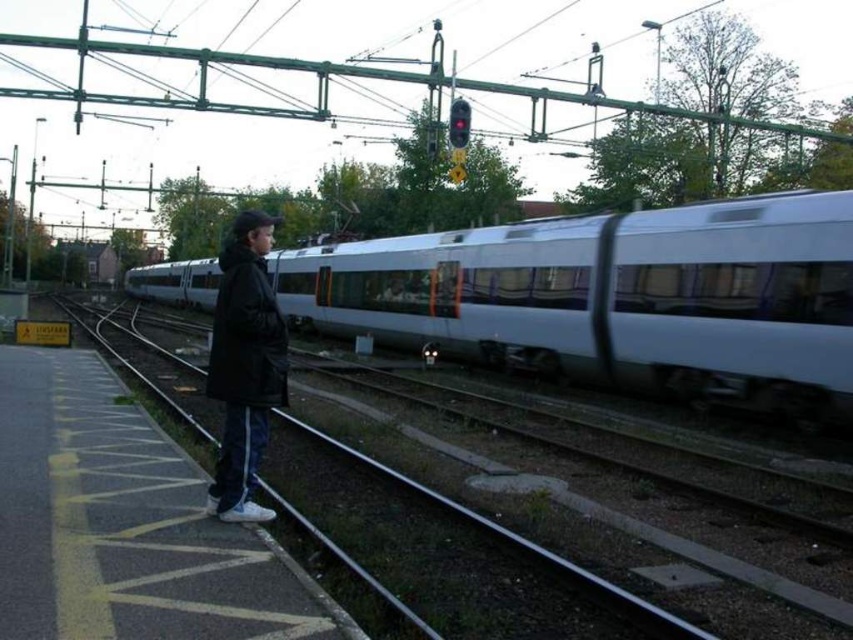
You are a passenger at the railway station and you want to board the train that is passing by. You see the metallic train track at center and the black matte jacket at left. Which object is closer to you?

The metallic train track at center is smaller than black matte jacket at left, which indicates that it is farther away. Therefore, the black matte jacket at left is closer to you.

You are a railway engineer inspecting the station. You notice the silver metallic train at center and the metallic train track at center. Which object is bigger in size?

The silver metallic train at center is larger in size compared to the metallic train track at center.

You are a passenger waiting at the railway station. You see the silver metallic train at center and the black matte jacket at left. Which object is closer to the right edge of the platform?

The silver metallic train at center is positioned on the right side of the black matte jacket at left, so it is closer to the right edge of the platform.